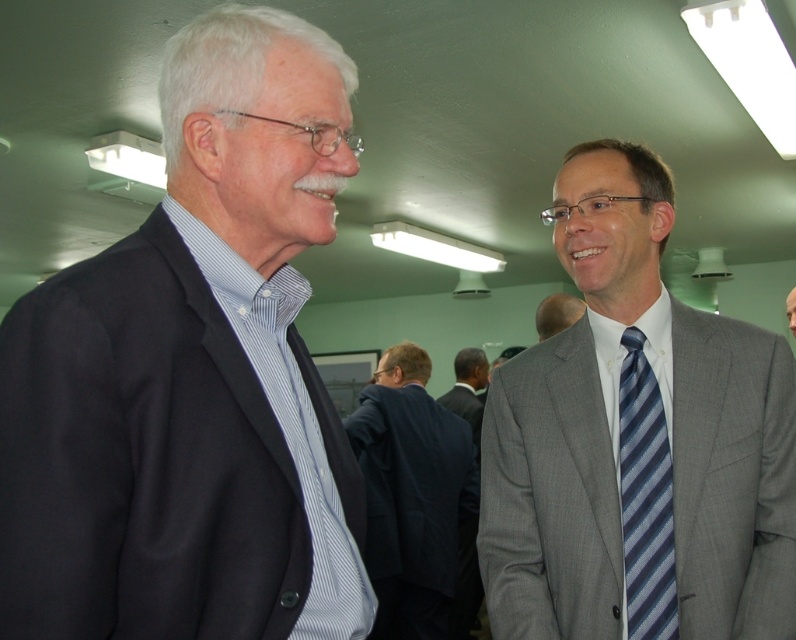
Question: Does blue striped tie at right appear on the right side of dark gray suit at center?

Choices:
 (A) no
 (B) yes

Answer: (B)

Question: Is blue striped tie at right positioned in front of gray suit at right?

Choices:
 (A) no
 (B) yes

Answer: (B)

Question: Which point is closer to the camera taking this photo?

Choices:
 (A) (x=794, y=301)
 (B) (x=622, y=416)
 (C) (x=556, y=301)
 (D) (x=544, y=420)

Answer: (B)

Question: Is blue striped tie at right to the right of gray suit at right from the viewer's perspective?

Choices:
 (A) yes
 (B) no

Answer: (B)

Question: Which point appears farthest from the camera in this image?

Choices:
 (A) (642, 576)
 (B) (549, 310)

Answer: (B)

Question: Estimate the real-world distances between objects in this image. Which object is closer to the matte black suit at left?

Choices:
 (A) gray suit at right
 (B) blue striped tie at right
 (C) gray textured suit at right
 (D) dark blue suit at center

Answer: (C)